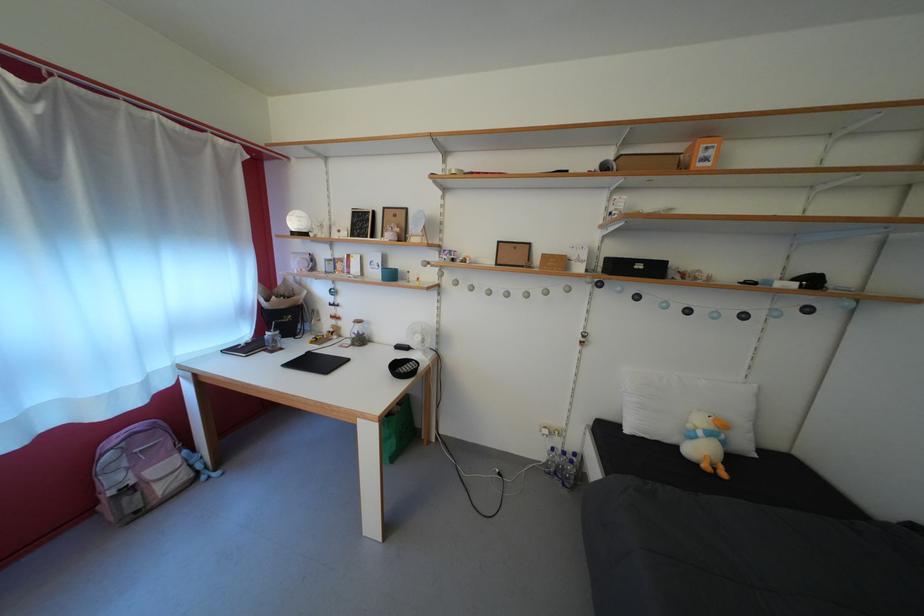
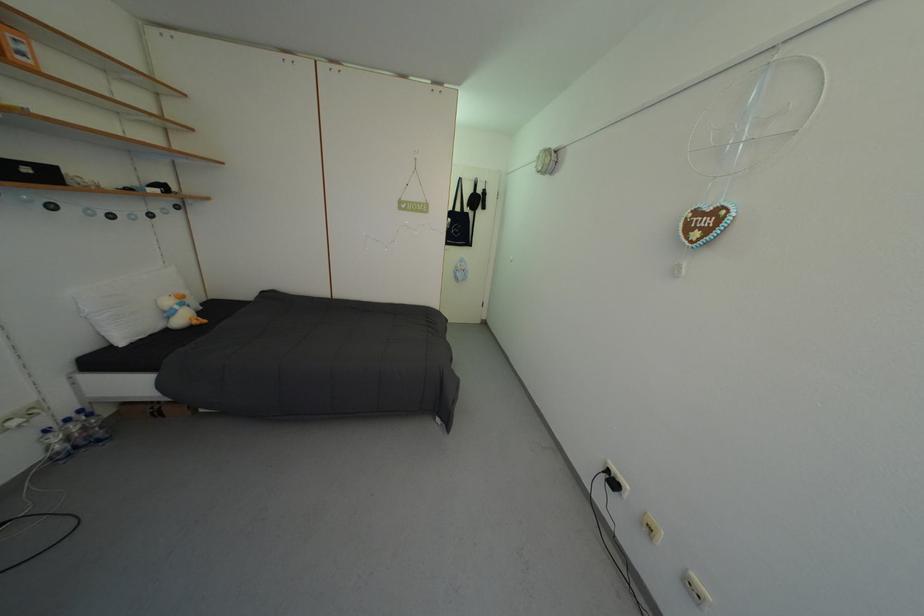
Find the pixel in the second image that matches the point at 582,460 in the first image.

(90, 416)